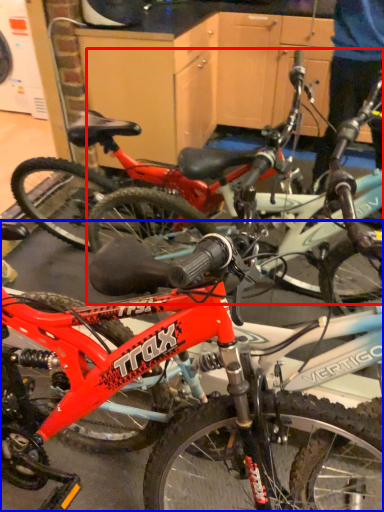
Question: Which point is closer to the camera, bicycle (highlighted by a red box) or bicycle (highlighted by a blue box)?

Choices:
 (A) bicycle
 (B) bicycle

Answer: (B)